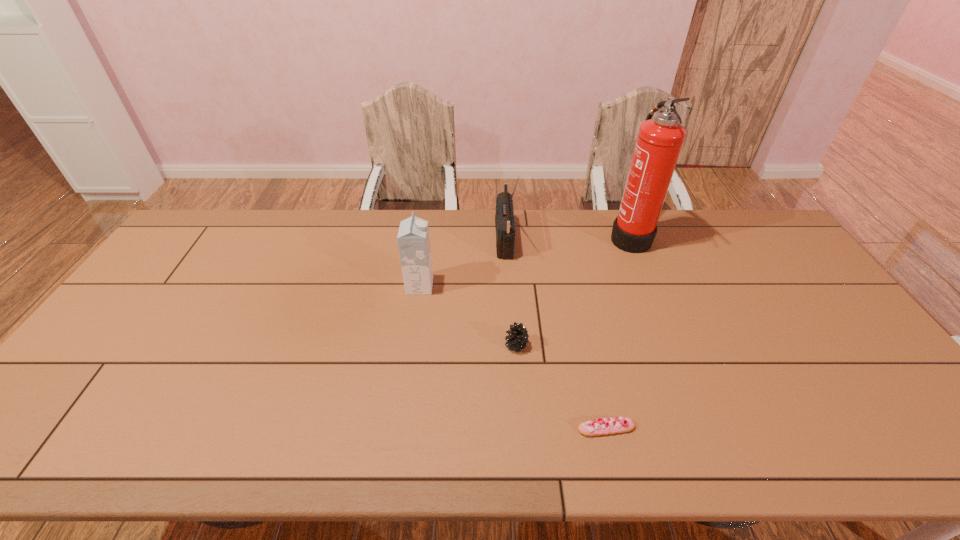
Image resolution: width=960 pixels, height=540 pixels. What are the coordinates of `vacant area that lies between the third shortest object and the fourth shortest object` in the screenshot? It's located at (462, 264).

At what (x,y) coordinates should I click in order to perform the action: click on vacant region between the nearest object and the radio receiver. Please return your answer as a coordinate pair (x, y). Image resolution: width=960 pixels, height=540 pixels. Looking at the image, I should click on (555, 335).

At what (x,y) coordinates should I click in order to perform the action: click on vacant area that lies between the third shortest object and the radio receiver. Please return your answer as a coordinate pair (x, y). The height and width of the screenshot is (540, 960). Looking at the image, I should click on point(462,264).

Where is `vacant space that is in between the third shortest object and the fire extinguisher`? The image size is (960, 540). vacant space that is in between the third shortest object and the fire extinguisher is located at coordinates (524, 261).

At what (x,y) coordinates should I click in order to perform the action: click on empty location between the radio receiver and the nearest object. Please return your answer as a coordinate pair (x, y). Image resolution: width=960 pixels, height=540 pixels. Looking at the image, I should click on (555, 335).

You are a GUI agent. You are given a task and a screenshot of the screen. Output one action in this format:
    pyautogui.click(x=<x>, y=<y>)
    Task: Click on the free spot between the third shortest object and the tallest object
    This screenshot has width=960, height=540.
    Given the screenshot: What is the action you would take?
    pyautogui.click(x=524, y=261)

The width and height of the screenshot is (960, 540). What are the coordinates of `free space between the carton and the fourth farthest object` in the screenshot? It's located at (468, 315).

This screenshot has height=540, width=960. What are the coordinates of `empty space that is in between the carton and the fourth tallest object` in the screenshot? It's located at (468, 315).

In order to click on object that stands as the closest to the third tallest object in this screenshot , I will do `click(504, 219)`.

Locate which object ranks in proximity to the fourth shortest object. Please provide its 2D coordinates. Your answer should be formatted as a tuple, i.e. [(x, y)], where the tuple contains the x and y coordinates of a point satisfying the conditions above.

[(413, 238)]